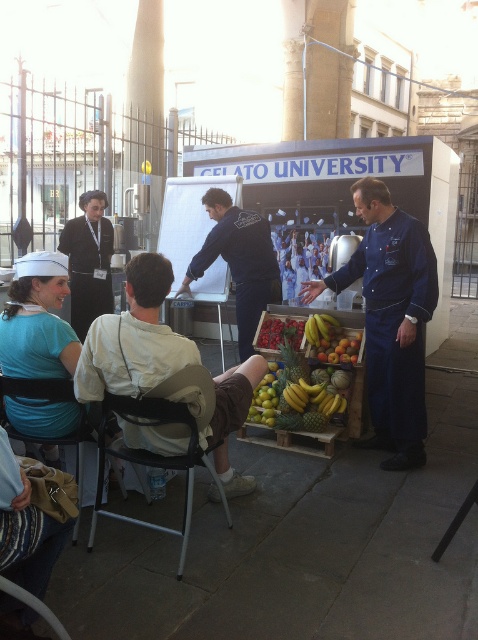
Can you confirm if blue cotton jacket at right is taller than matte blue uniform at lower left?

Yes, blue cotton jacket at right is taller than matte blue uniform at lower left.

Who is higher up, blue cotton jacket at right or matte blue uniform at lower left?

blue cotton jacket at right is higher up.

Is point (404, 422) in front of point (34, 429)?

No, it is behind (34, 429).

Find the location of a particular element. The height and width of the screenshot is (640, 478). blue cotton jacket at right is located at coordinates (394, 323).

Can you confirm if light beige shirt at center is taller than black fabric uniform at left?

Correct, light beige shirt at center is much taller as black fabric uniform at left.

Is point (166, 449) in front of point (82, 337)?

Yes.

The width and height of the screenshot is (478, 640). What are the coordinates of `light beige shirt at center` in the screenshot? It's located at (133, 339).

Can you confirm if dark blue fabric at center is bigger than matte blue uniform at lower left?

Indeed, dark blue fabric at center has a larger size compared to matte blue uniform at lower left.

Which of these two, dark blue fabric at center or matte blue uniform at lower left, stands taller?

dark blue fabric at center

Is point (209, 244) in front of point (37, 429)?

No, it is not.

Identify the location of dark blue fabric at center. This screenshot has height=640, width=478. (240, 264).